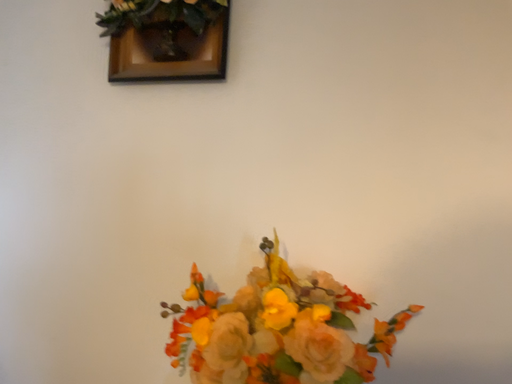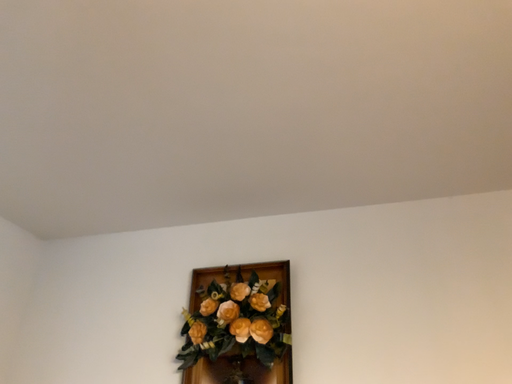
Question: Which way did the camera rotate in the video?

Choices:
 (A) rotated downward
 (B) rotated upward

Answer: (B)